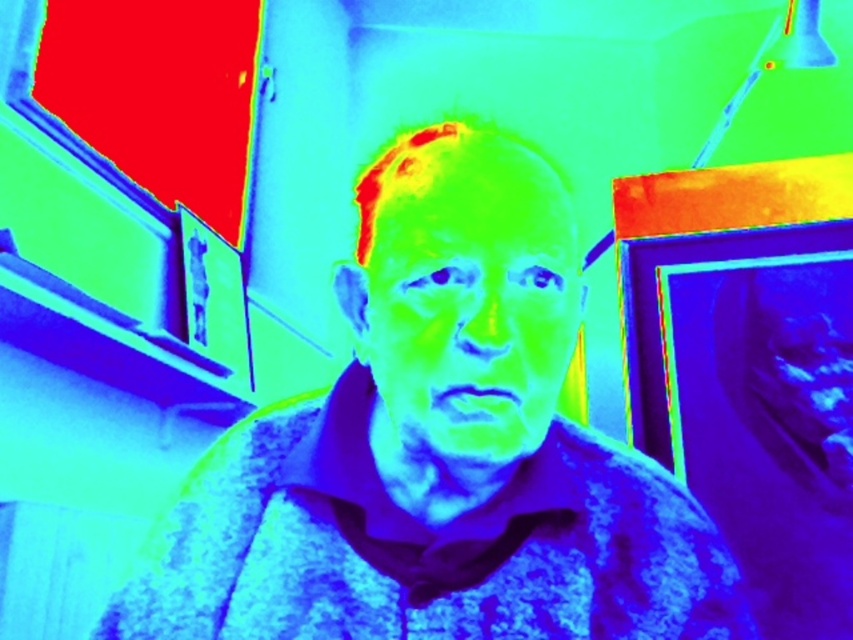
Question: Is fluffy fabric man at center above matte skin face at center?

Choices:
 (A) yes
 (B) no

Answer: (B)

Question: Among these points, which one is nearest to the camera?

Choices:
 (A) (397, 381)
 (B) (677, 614)

Answer: (A)

Question: Considering the relative positions of fluffy fabric man at center and matte skin face at center in the image provided, where is fluffy fabric man at center located with respect to matte skin face at center?

Choices:
 (A) above
 (B) below

Answer: (B)

Question: Which point is farther from the camera taking this photo?

Choices:
 (A) (440, 205)
 (B) (369, 298)

Answer: (B)

Question: Which point appears closest to the camera in this image?

Choices:
 (A) 339,477
 (B) 387,266

Answer: (B)

Question: Is fluffy fabric man at center smaller than matte skin face at center?

Choices:
 (A) yes
 (B) no

Answer: (B)